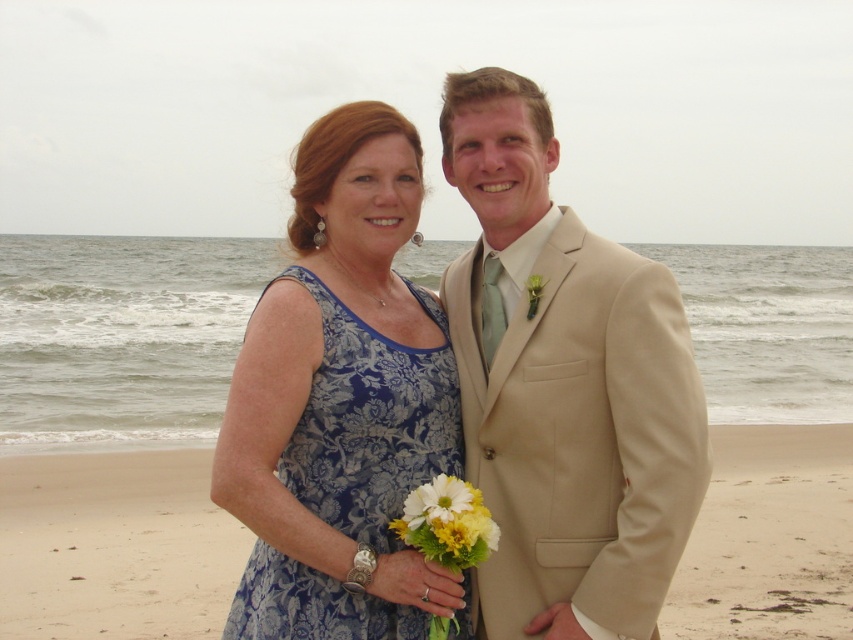
You are a photographer standing at the edge of the beach. You need to place a small tripod at the point marked by the coordinates point (114,547). Based on the scene description, what will the tripod be placed on?

The point (114,547) marks beige sand at lower center, so the tripod will be placed on the beige sand at lower center.

You are a photographer trying to capture the couple in the scene. You want to ensure that both the beige suit at center and the beige sand at lower center are clearly visible in your shot. Which object should you focus on first to ensure proper exposure, considering their size differences?

The beige suit at center has a lesser width compared to beige sand at lower center, so you should focus on the beige sand at lower center first because it covers a larger area and will require more attention to ensure proper exposure.